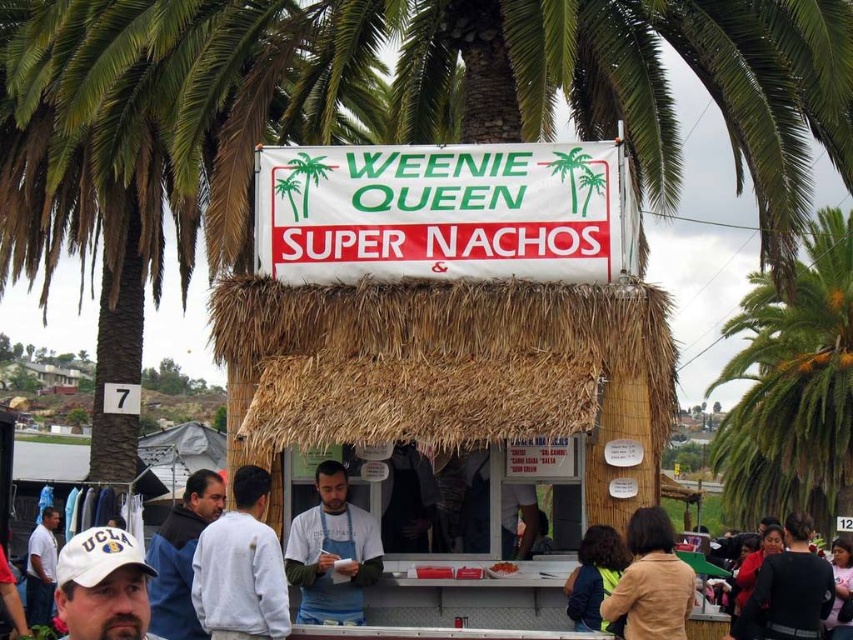
Question: Can you confirm if dark blue jacket at lower left is thinner than black fabric canopy at lower left?

Choices:
 (A) no
 (B) yes

Answer: (B)

Question: Which point is closer to the camera taking this photo?

Choices:
 (A) (216, 435)
 (B) (187, 627)
 (C) (508, 572)

Answer: (B)

Question: Observing the image, what is the correct spatial positioning of white matte shirt at center in reference to white matte shirt at lower left?

Choices:
 (A) left
 (B) right

Answer: (B)

Question: Does dark brown leather jacket at lower right come behind white matte shirt at lower left?

Choices:
 (A) yes
 (B) no

Answer: (B)

Question: Which of the following is the closest to the observer?

Choices:
 (A) (509, 566)
 (B) (354, 198)

Answer: (A)

Question: Which object appears farthest from the camera in this image?

Choices:
 (A) white matte shirt at center
 (B) orange matte nachos at center
 (C) white fabric cap at lower left
 (D) white fabric sign at center

Answer: (B)